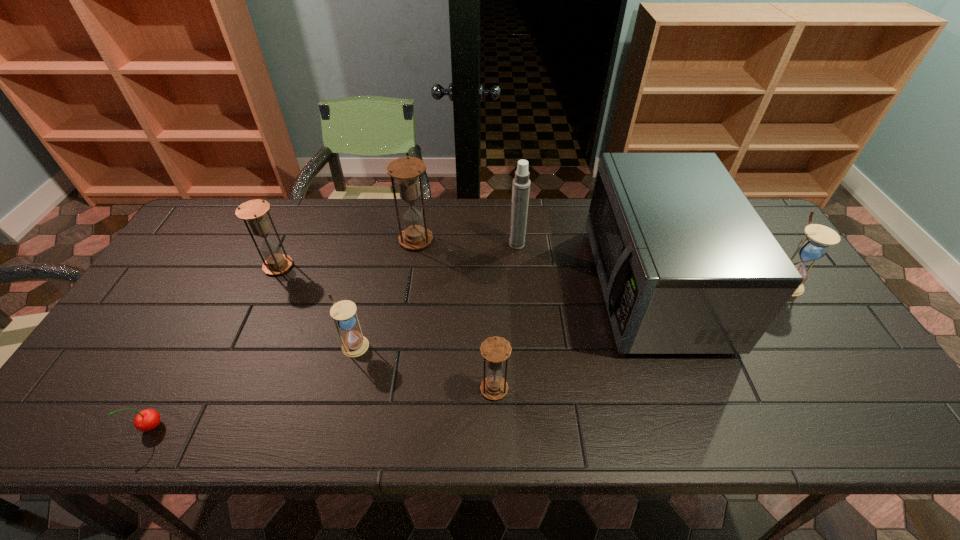
What are the coordinates of `vacant area situated 0.260m on the right of the leftmost brown hourglass` in the screenshot? It's located at (381, 266).

Image resolution: width=960 pixels, height=540 pixels. What are the coordinates of `vacant space located on the front of the right white hourglass` in the screenshot? It's located at (883, 431).

Locate an element on the screen. vacant area situated 0.070m on the front of the third object from left to right is located at coordinates [346, 382].

Locate an element on the screen. The image size is (960, 540). free space located 0.070m on the right of the rightmost brown hourglass is located at coordinates (539, 389).

I want to click on free point located on the back of the leftmost object, so click(204, 329).

Image resolution: width=960 pixels, height=540 pixels. Find the location of `aerosol can present at the far edge`. aerosol can present at the far edge is located at coordinates (521, 183).

This screenshot has height=540, width=960. I want to click on microwave oven located at the far edge, so point(686,265).

I want to click on hourglass positioned at the far edge, so click(x=406, y=170).

At what (x,y) coordinates should I click in order to perform the action: click on hourglass that is at the near edge. Please return your answer as a coordinate pair (x, y). Looking at the image, I should click on (495, 350).

Locate an element on the screen. cherry that is at the near edge is located at coordinates (146, 420).